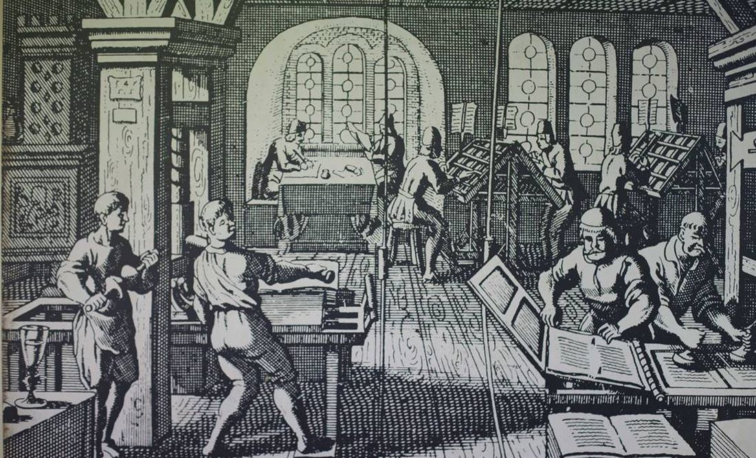
Find the location of `wall`. wall is located at coordinates (441, 42).